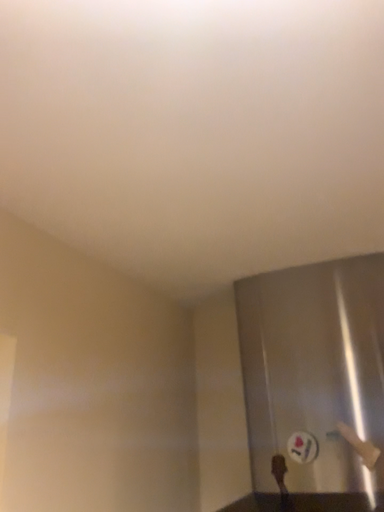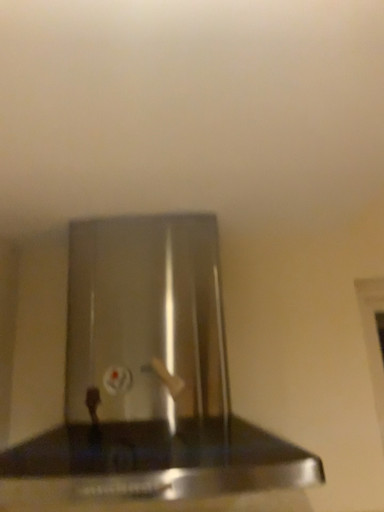
Question: How did the camera likely rotate when shooting the video?

Choices:
 (A) rotated upward
 (B) rotated downward

Answer: (B)